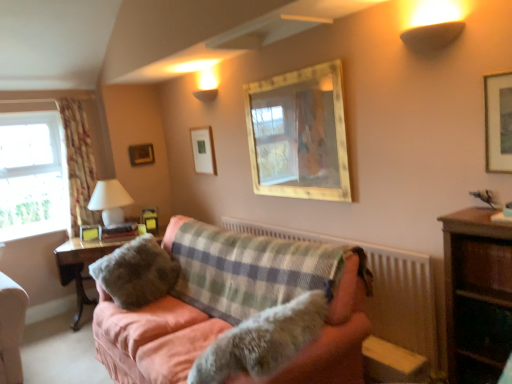
Question: Does fuzzy fabric pillow at center appear on the left side of clear glass window at left?

Choices:
 (A) no
 (B) yes

Answer: (A)

Question: Does fuzzy fabric pillow at center have a greater width compared to clear glass window at left?

Choices:
 (A) yes
 (B) no

Answer: (A)

Question: Considering the relative sizes of fuzzy fabric pillow at center and clear glass window at left in the image provided, is fuzzy fabric pillow at center shorter than clear glass window at left?

Choices:
 (A) yes
 (B) no

Answer: (A)

Question: Is the depth of fuzzy fabric pillow at center greater than that of clear glass window at left?

Choices:
 (A) yes
 (B) no

Answer: (B)

Question: From the image's perspective, does fuzzy fabric pillow at center appear higher than clear glass window at left?

Choices:
 (A) no
 (B) yes

Answer: (A)

Question: Is point (473, 377) closer or farther from the camera than point (190, 377)?

Choices:
 (A) closer
 (B) farther

Answer: (B)

Question: From the image's perspective, relative to fuzzy fur dog at center, is wooden bookshelf at right, the 2th table when ordered from back to front, above or below?

Choices:
 (A) below
 (B) above

Answer: (B)

Question: Choose the correct answer: Is wooden bookshelf at right, which is the first table from front to back, inside fuzzy fur dog at center or outside it?

Choices:
 (A) outside
 (B) inside

Answer: (A)

Question: Considering their positions, is wooden bookshelf at right, the 1th table from the right, located in front of or behind fuzzy fur dog at center?

Choices:
 (A) front
 (B) behind

Answer: (B)

Question: Is matte gold wall sconce at upper right bigger or smaller than fuzzy fabric pillow at center?

Choices:
 (A) small
 (B) big

Answer: (A)

Question: Is point (433, 44) positioned closer to the camera than point (123, 264)?

Choices:
 (A) closer
 (B) farther

Answer: (A)

Question: Relative to fuzzy fabric pillow at center, is matte gold wall sconce at upper right in front or behind?

Choices:
 (A) behind
 (B) front

Answer: (B)

Question: In the image, is matte gold wall sconce at upper right on the left side or the right side of fuzzy fabric pillow at center?

Choices:
 (A) right
 (B) left

Answer: (A)

Question: From a real-world perspective, is white glossy table lamp at left above or below clear glass window at left?

Choices:
 (A) above
 (B) below

Answer: (B)

Question: Is point (104, 190) positioned closer to the camera than point (18, 228)?

Choices:
 (A) farther
 (B) closer

Answer: (B)